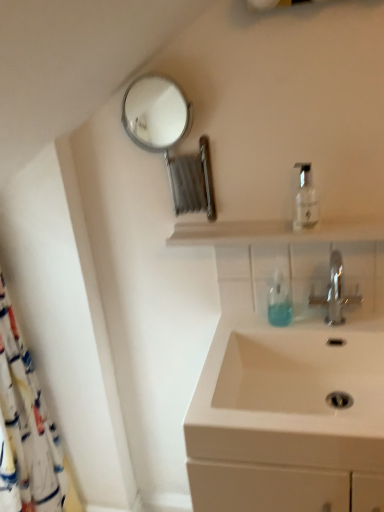
Describe the element at coordinates (170, 140) in the screenshot. I see `metallic circular mirror at upper left` at that location.

What do you see at coordinates (305, 200) in the screenshot? I see `clear plastic bottle at upper right` at bounding box center [305, 200].

From the picture: In order to face silver metallic faucet at center, should I rotate leftwards or rightwards?

Rotate your view right by about 18.754°.

Where is `translucent plastic soap dispenser at center`? The width and height of the screenshot is (384, 512). translucent plastic soap dispenser at center is located at coordinates (279, 301).

I want to click on white fabric shower curtain at left, so tap(28, 420).

Image resolution: width=384 pixels, height=512 pixels. I want to click on transparent glass shelf at center, so click(275, 232).

Is transparent glass shelf at center touching translucent plastic soap dispenser at center?

No, transparent glass shelf at center is not touching translucent plastic soap dispenser at center.

Which object is thinner, transparent glass shelf at center or translucent plastic soap dispenser at center?

With smaller width is translucent plastic soap dispenser at center.

The width and height of the screenshot is (384, 512). Find the location of `balustrade that appears on the left of translucent plastic soap dispenser at center`. balustrade that appears on the left of translucent plastic soap dispenser at center is located at coordinates (275, 232).

Who is more distant, transparent glass shelf at center or translucent plastic soap dispenser at center?

Positioned behind is translucent plastic soap dispenser at center.

From the image's perspective, relative to translucent plastic soap dispenser at center, is silver metallic faucet at center above or below?

silver metallic faucet at center is situated higher than translucent plastic soap dispenser at center in the image.

Is silver metallic faucet at center inside or outside of translucent plastic soap dispenser at center?

The correct answer is: outside.

Looking at this image, can you confirm if silver metallic faucet at center is shorter than translucent plastic soap dispenser at center?

Incorrect, the height of silver metallic faucet at center does not fall short of that of translucent plastic soap dispenser at center.

Which of these two, silver metallic faucet at center or translucent plastic soap dispenser at center, is wider?

With larger width is silver metallic faucet at center.

Is white ceramic sink at lower right thinner than silver metallic faucet at center?

No.

Is the surface of white ceramic sink at lower right in direct contact with silver metallic faucet at center?

They are not placed beside each other.

Locate an element on the screen. tap lying above the white ceramic sink at lower right (from the image's perspective) is located at coordinates (335, 293).

Could you tell me if white ceramic sink at lower right is turned towards silver metallic faucet at center?

No, white ceramic sink at lower right does not turn towards silver metallic faucet at center.

Can you confirm if white fabric shower curtain at left is positioned to the left of metallic circular mirror at upper left?

Indeed, white fabric shower curtain at left is positioned on the left side of metallic circular mirror at upper left.

Is white fabric shower curtain at left facing away from metallic circular mirror at upper left?

No, white fabric shower curtain at left is not facing the opposite direction of metallic circular mirror at upper left.

This screenshot has height=512, width=384. In the image, there is a metallic circular mirror at upper left. Find the location of `shower curtain below it (from a real-world perspective)`. shower curtain below it (from a real-world perspective) is located at coordinates (28, 420).

In terms of width, does white fabric shower curtain at left look wider or thinner when compared to metallic circular mirror at upper left?

white fabric shower curtain at left is wider than metallic circular mirror at upper left.

Who is taller, metallic circular mirror at upper left or translucent plastic soap dispenser at center?

Standing taller between the two is metallic circular mirror at upper left.

Is metallic circular mirror at upper left positioned behind translucent plastic soap dispenser at center?

No, metallic circular mirror at upper left is closer to the viewer.

Considering the points (149, 123) and (271, 301), which point is behind, point (149, 123) or point (271, 301)?

The point (149, 123) is behind.

Based on the photo, is translucent plastic soap dispenser at center next to white ceramic sink at lower right and touching it?

They are not placed beside each other.

Which of these two, translucent plastic soap dispenser at center or white ceramic sink at lower right, stands shorter?

With less height is white ceramic sink at lower right.

From the image's perspective, is translucent plastic soap dispenser at center on white ceramic sink at lower right?

Yes, from the image's perspective, translucent plastic soap dispenser at center is above white ceramic sink at lower right.

Is white ceramic sink at lower right looking in the opposite direction of white fabric shower curtain at left?

No, white ceramic sink at lower right is not facing away from white fabric shower curtain at left.

Can you confirm if white ceramic sink at lower right is smaller than white fabric shower curtain at left?

Yes, white ceramic sink at lower right is smaller than white fabric shower curtain at left.

Which object is positioned more to the right, white ceramic sink at lower right or white fabric shower curtain at left?

From the viewer's perspective, white ceramic sink at lower right appears more on the right side.

From the image's perspective, is white ceramic sink at lower right located above or below white fabric shower curtain at left?

Clearly, from the image's perspective, white ceramic sink at lower right is above white fabric shower curtain at left.

This screenshot has height=512, width=384. What are the coordinates of `balustrade in front of the translucent plastic soap dispenser at center` in the screenshot? It's located at (275, 232).

The height and width of the screenshot is (512, 384). Find the location of `soap dispenser that is on the left side of silver metallic faucet at center`. soap dispenser that is on the left side of silver metallic faucet at center is located at coordinates (279, 301).

Estimate the real-world distances between objects in this image. Which object is further from translucent plastic soap dispenser at center, transparent glass shelf at center or silver metallic faucet at center?

Among the two, transparent glass shelf at center is located further to translucent plastic soap dispenser at center.

Looking at the image, which one is located closer to clear plastic bottle at upper right, white ceramic sink at lower right or metallic circular mirror at upper left?

Among the two, white ceramic sink at lower right is located nearer to clear plastic bottle at upper right.

From the image, which object appears to be farther from transparent glass shelf at center, silver metallic faucet at center or white ceramic sink at lower right?

white ceramic sink at lower right is further to transparent glass shelf at center.

From the image, which object appears to be farther from metallic circular mirror at upper left, translucent plastic soap dispenser at center or white fabric shower curtain at left?

white fabric shower curtain at left.

Looking at the image, which one is located further to white ceramic sink at lower right, translucent plastic soap dispenser at center or white fabric shower curtain at left?

white fabric shower curtain at left is positioned further to the anchor white ceramic sink at lower right.

Looking at the image, which one is located further to metallic circular mirror at upper left, clear plastic bottle at upper right or silver metallic faucet at center?

Based on the image, silver metallic faucet at center appears to be further to metallic circular mirror at upper left.

Considering their positions, is metallic circular mirror at upper left positioned closer to white fabric shower curtain at left than white ceramic sink at lower right?

The object closer to white fabric shower curtain at left is white ceramic sink at lower right.

Based on their spatial positions, is white fabric shower curtain at left or transparent glass shelf at center further from clear plastic bottle at upper right?

white fabric shower curtain at left.

At what (x,y) coordinates should I click in order to perform the action: click on tap between clear plastic bottle at upper right and white ceramic sink at lower right in the up-down direction. Please return your answer as a coordinate pair (x, y). The width and height of the screenshot is (384, 512). Looking at the image, I should click on (335, 293).

Locate an element on the screen. The width and height of the screenshot is (384, 512). soap dispenser situated between white fabric shower curtain at left and white ceramic sink at lower right from left to right is located at coordinates (279, 301).

This screenshot has width=384, height=512. What are the coordinates of `balustrade between metallic circular mirror at upper left and translucent plastic soap dispenser at center from top to bottom` in the screenshot? It's located at pos(275,232).

Locate an element on the screen. The width and height of the screenshot is (384, 512). balustrade between white fabric shower curtain at left and translucent plastic soap dispenser at center from left to right is located at coordinates (275, 232).